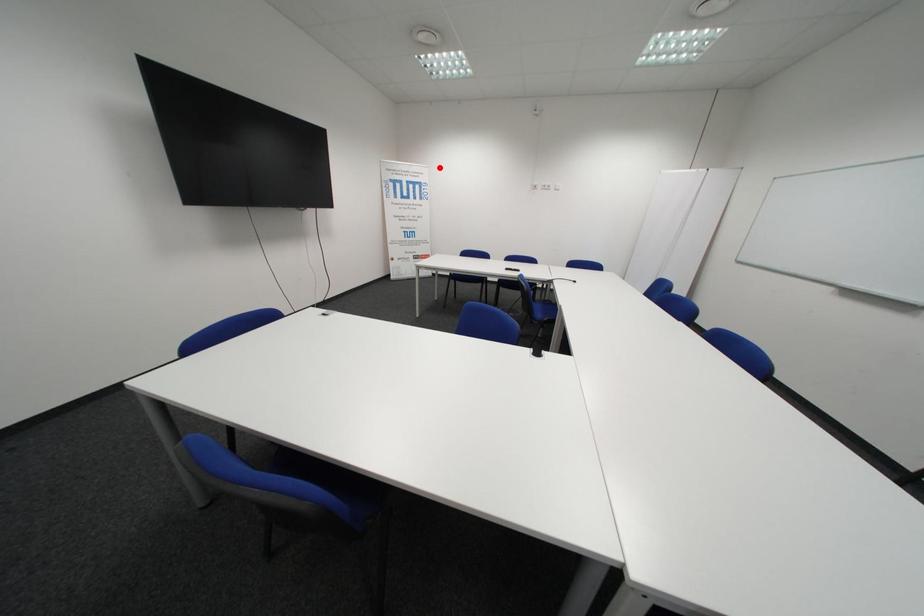
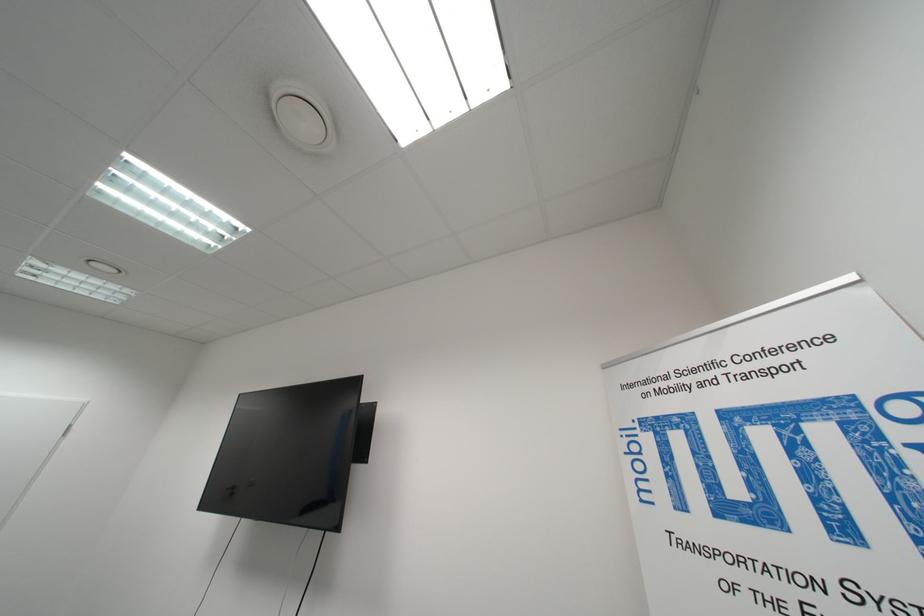
Locate, in the second image, the point that corresponds to the highlighted location in the first image.

(861, 278)